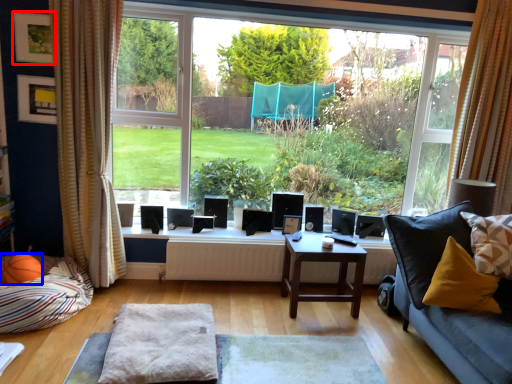
Question: Among these objects, which one is nearest to the camera, picture frame (highlighted by a red box) or basketball (highlighted by a blue box)?

Choices:
 (A) picture frame
 (B) basketball

Answer: (B)